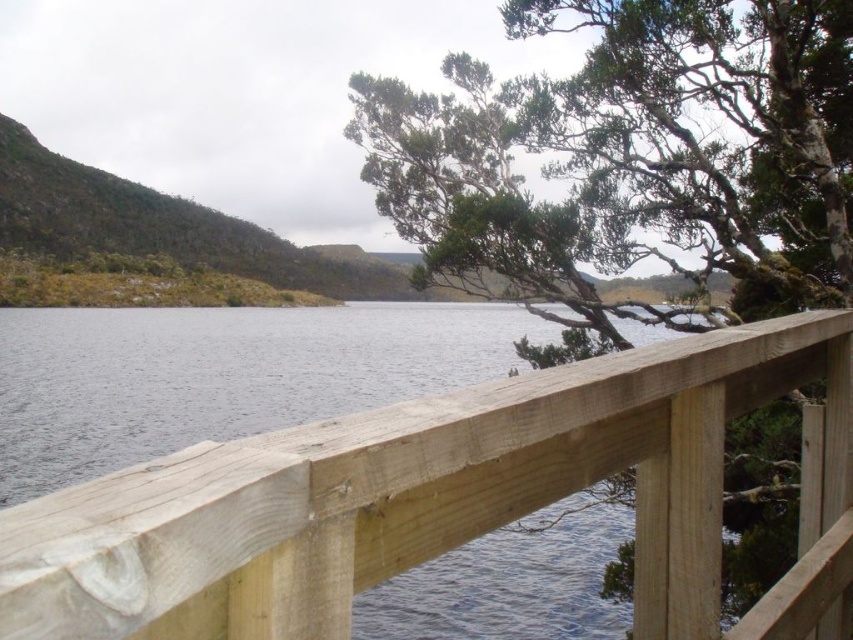
You are standing at the edge of the wooden railing in the center of the image. If you want to walk towards the hills in the distance, which direction should you move relative to the natural wood railing at center?

Since the natural wood railing at center is positioned at coordinates approximately 0.772 on the x axis and 0.488 on the y axis, you should move away from the natural wood railing at center towards the hills in the distance.

You are standing at the edge of a wooden railing and looking out at the landscape. Which object in the scene is larger when viewed from your perspective? The natural wood railing at center or the green textured tree at upper center?

The green textured tree at upper center is larger than the natural wood railing at center when viewed from your perspective.